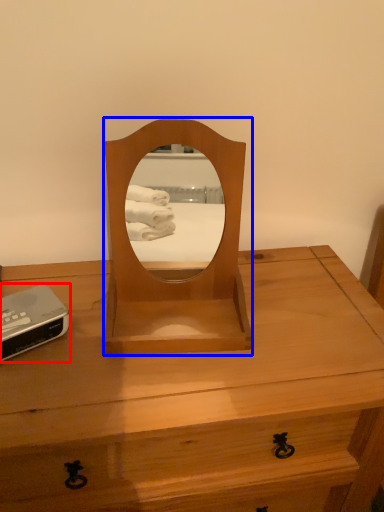
Question: Which object appears closest to the camera in this image, gadget (highlighted by a red box) or mirror (highlighted by a blue box)?

Choices:
 (A) gadget
 (B) mirror

Answer: (B)